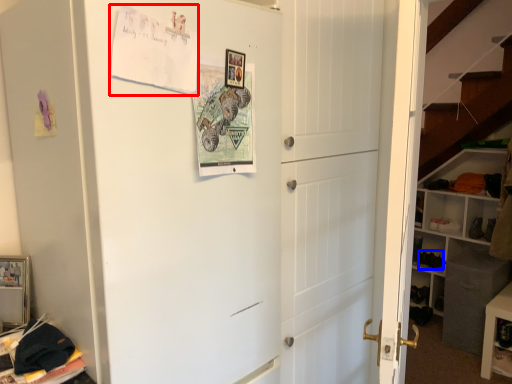
Question: Which point is further to the camera, postcard (highlighted by a red box) or shoe (highlighted by a blue box)?

Choices:
 (A) postcard
 (B) shoe

Answer: (B)